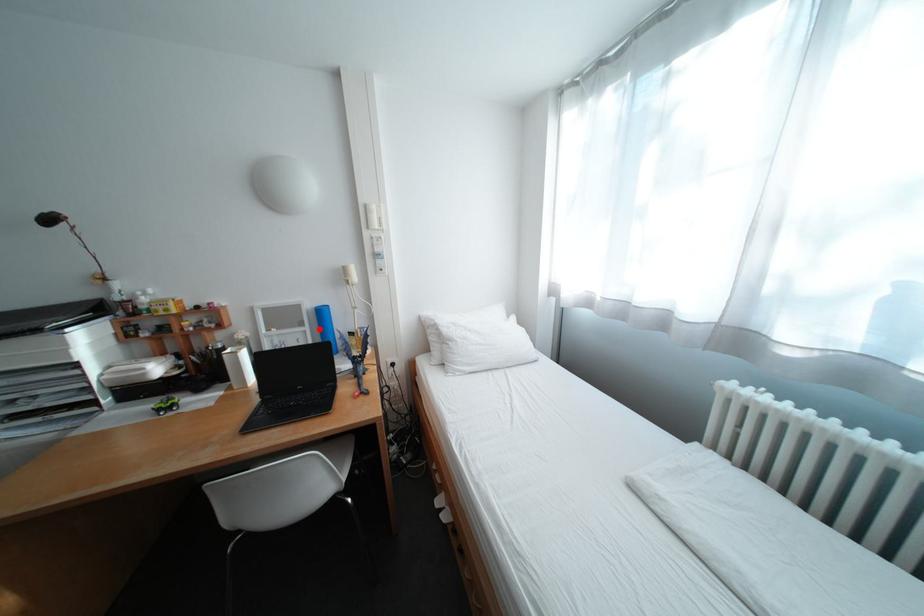
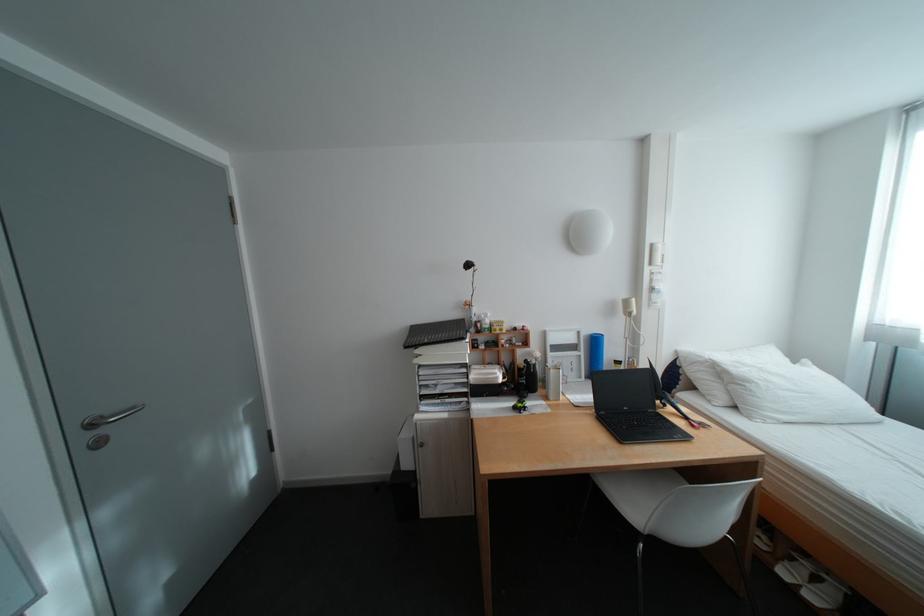
Locate, in the second image, the point that corresponds to the highlighted location in the first image.

(594, 354)